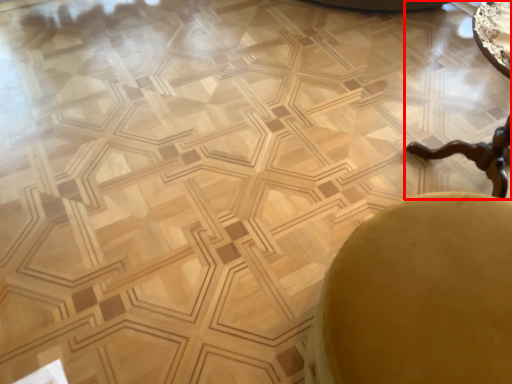
Question: In this image, where is cocktail table (annotated by the red box) located relative to swivel chair?

Choices:
 (A) left
 (B) right

Answer: (B)